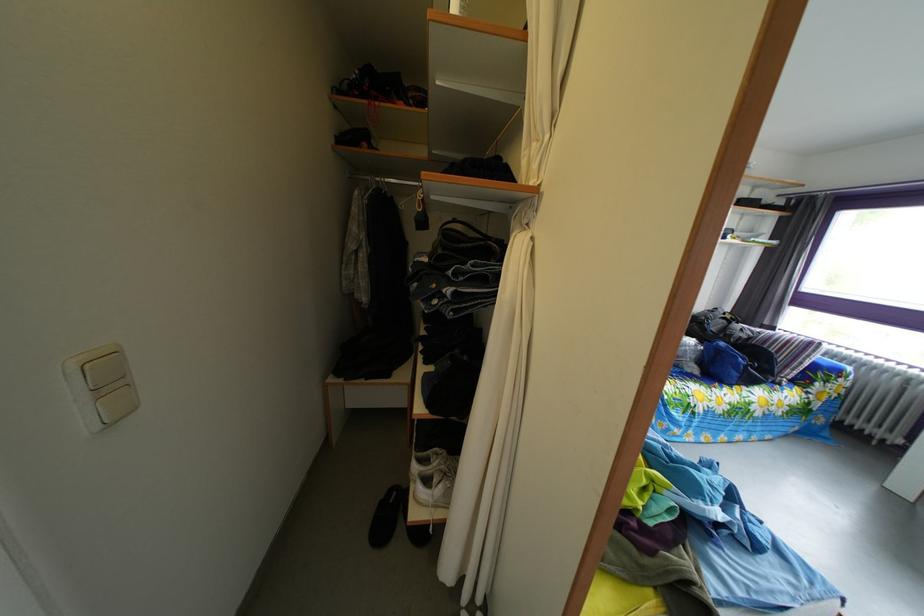
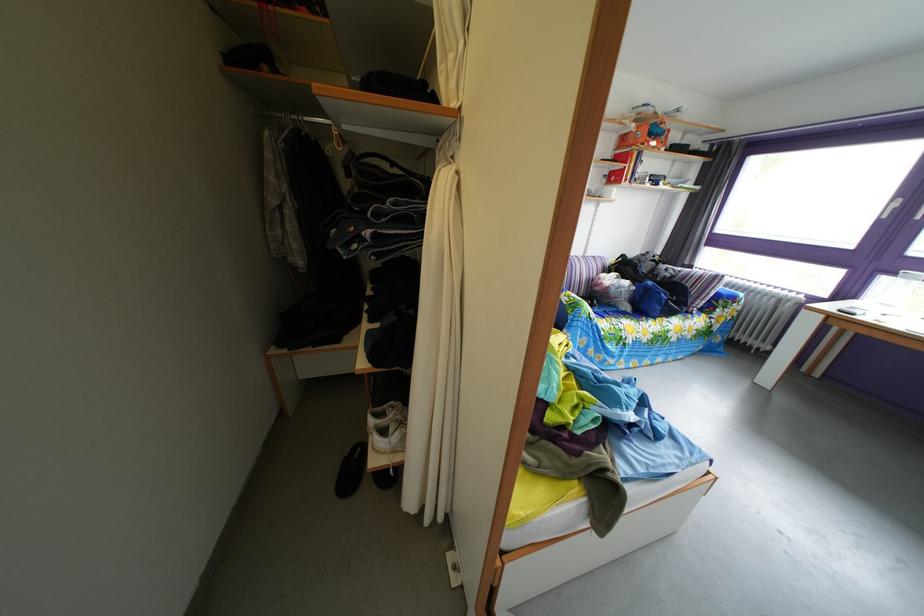
Where in the second image is the point corresponding to the point at 514,270 from the first image?

(438, 207)